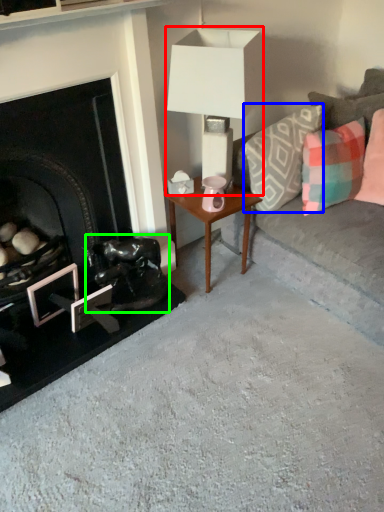
Question: Based on their relative distances, which object is farther from table lamp (highlighted by a red box)? Choose from pillow (highlighted by a blue box) and swivel chair (highlighted by a green box).

Choices:
 (A) pillow
 (B) swivel chair

Answer: (B)